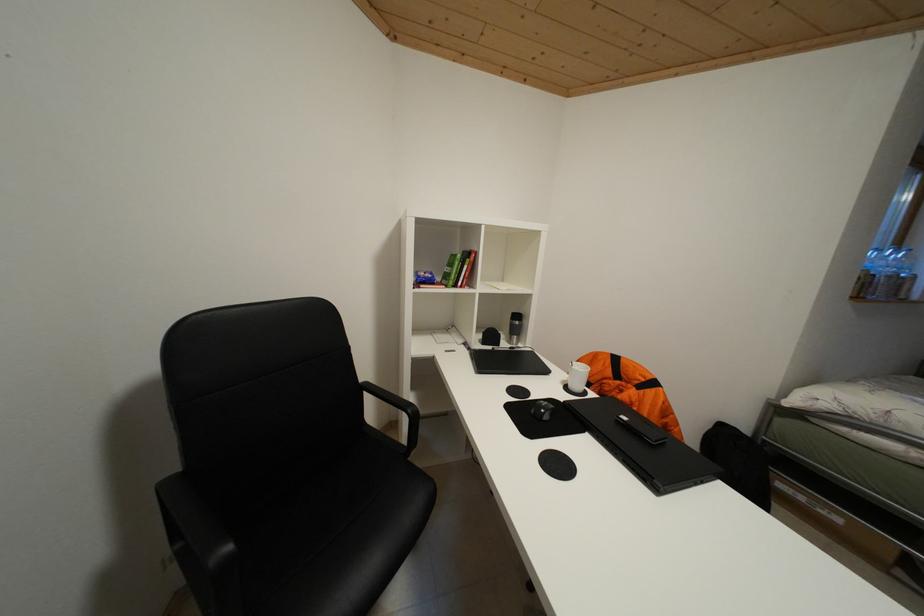
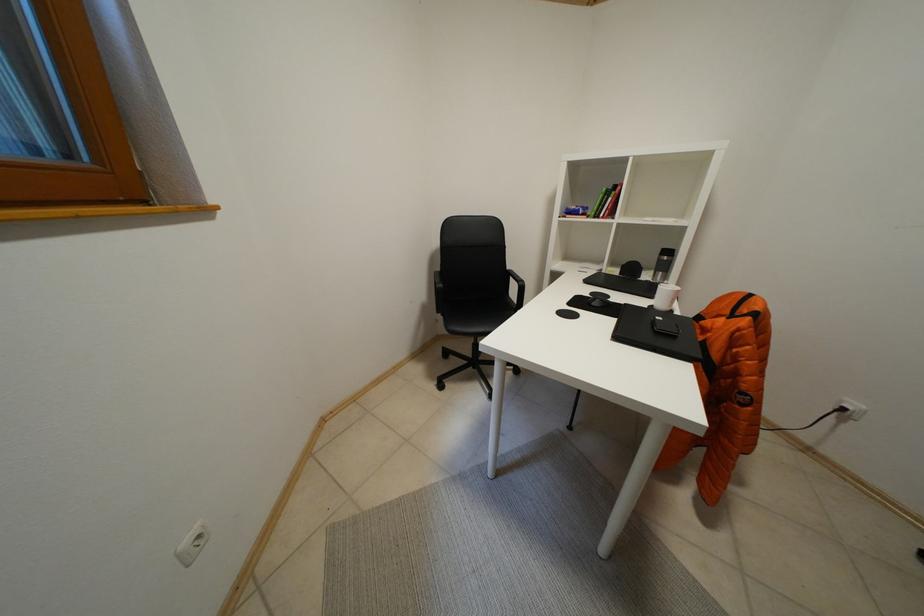
Question: The camera is either moving clockwise (left) or counter-clockwise (right) around the object. The first image is from the beginning of the video and the second image is from the end. Is the camera moving left or right when shooting the video?

Choices:
 (A) Left
 (B) Right

Answer: (B)